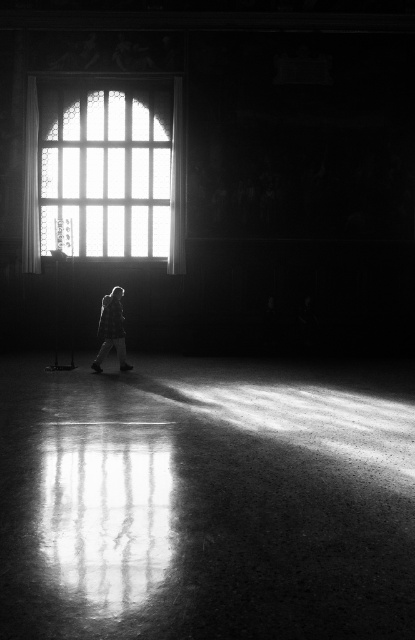
Which is below, clear glass window at upper center or silvery metallic jacket at center?

silvery metallic jacket at center is lower down.

Where is `clear glass window at upper center`? Image resolution: width=415 pixels, height=640 pixels. clear glass window at upper center is located at coordinates (104, 170).